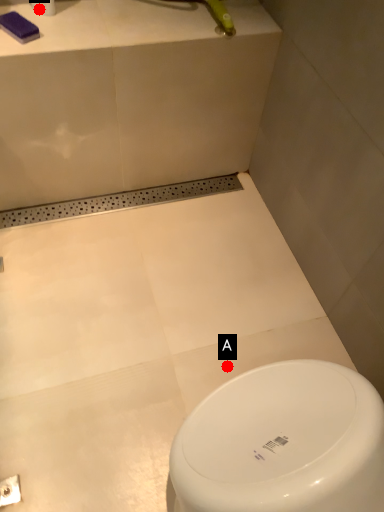
Question: Two points are circled on the image, labeled by A and B beside each circle. Which of the following is the farthest from the observer?

Choices:
 (A) A is further
 (B) B is further

Answer: (A)